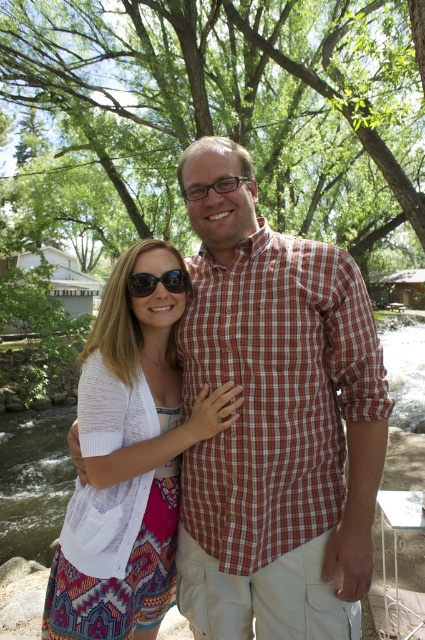
Question: Which point is closer to the camera?

Choices:
 (A) green water at creek center
 (B) green leafy tree at upper center

Answer: (A)

Question: Which of the following is the farthest from the observer?

Choices:
 (A) (147, 275)
 (B) (237, 211)
 (C) (153, 99)

Answer: (C)

Question: Which point is closer to the camera?

Choices:
 (A) white textured cardigan at center
 (B) green water at creek center
 (C) green leafy tree at upper center
 (D) checkered fabric shirt at center

Answer: (D)

Question: From the image, what is the correct spatial relationship of checkered fabric shirt at center in relation to black reflective sunglasses at center?

Choices:
 (A) below
 (B) above

Answer: (A)

Question: Considering the relative positions of checkered fabric shirt at center and white textured cardigan at center in the image provided, where is checkered fabric shirt at center located with respect to white textured cardigan at center?

Choices:
 (A) below
 (B) above

Answer: (B)

Question: Is the position of white textured cardigan at center more distant than that of black reflective sunglasses at center?

Choices:
 (A) yes
 (B) no

Answer: (B)